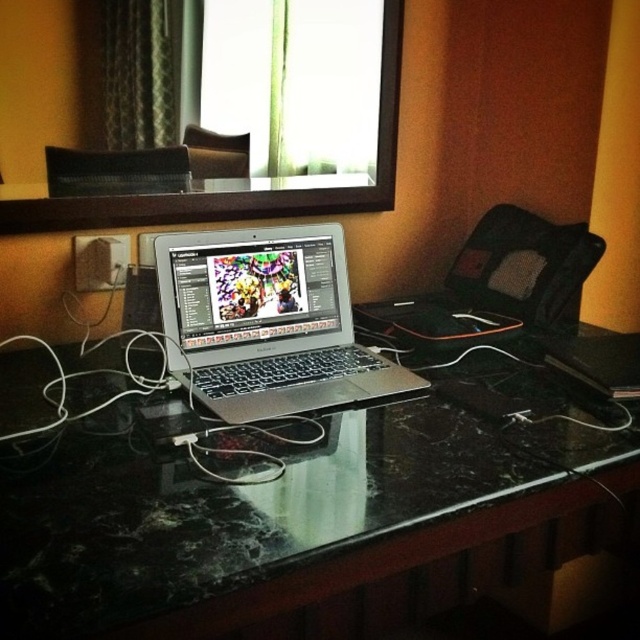
Question: Can you confirm if black marble computer desk at center is positioned to the left of silver metallic laptop at center?

Choices:
 (A) no
 (B) yes

Answer: (A)

Question: Which object appears closest to the camera in this image?

Choices:
 (A) silver metallic laptop at center
 (B) black marble computer desk at center

Answer: (B)

Question: Does black marble computer desk at center have a greater width compared to silver metallic laptop at center?

Choices:
 (A) yes
 (B) no

Answer: (A)

Question: Is black marble computer desk at center positioned in front of silver metallic laptop at center?

Choices:
 (A) yes
 (B) no

Answer: (A)

Question: Which object is farther from the camera taking this photo?

Choices:
 (A) black marble computer desk at center
 (B) silver metallic laptop at center

Answer: (B)